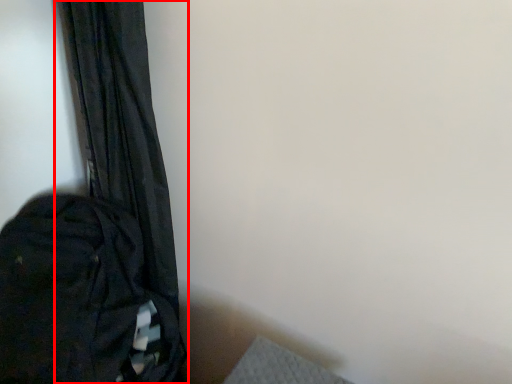
Question: From the image's perspective, what is the correct spatial relationship of curtain (annotated by the red box) in relation to backpack?

Choices:
 (A) below
 (B) above

Answer: (B)